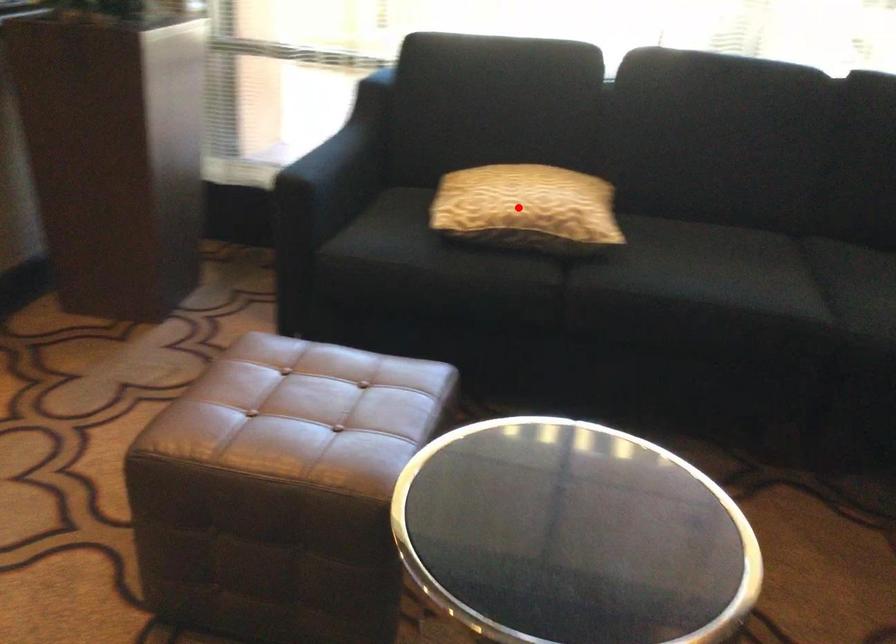
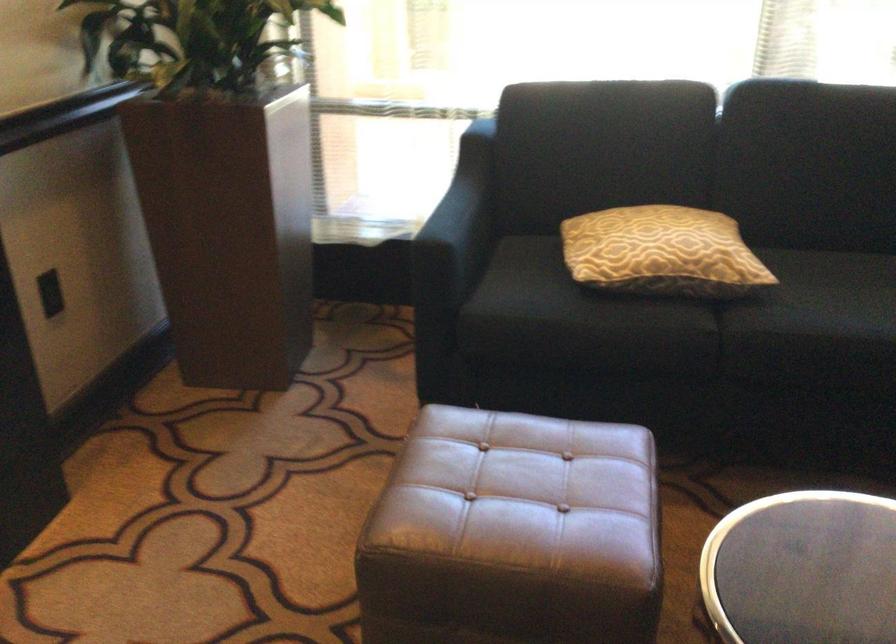
Locate, in the second image, the point that corresponds to the highlighted location in the first image.

(661, 252)